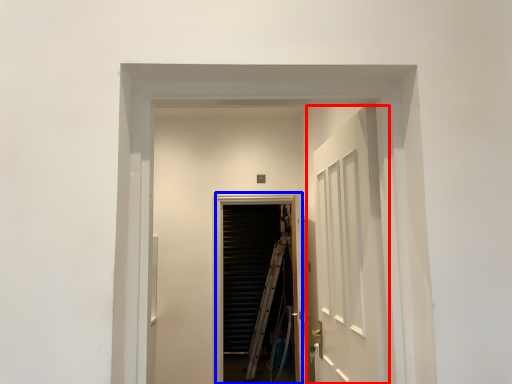
Question: Which point is further to the camera, door (highlighted by a red box) or screen door (highlighted by a blue box)?

Choices:
 (A) door
 (B) screen door

Answer: (B)